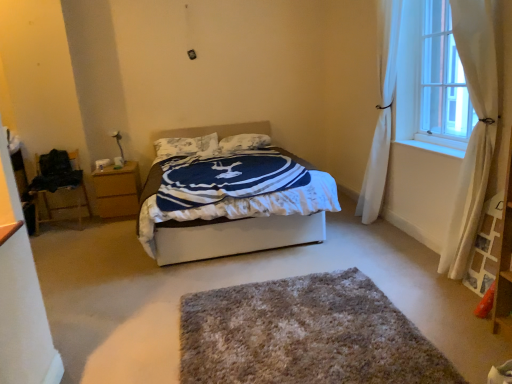
Describe the element at coordinates (232, 236) in the screenshot. I see `white soft bed at center` at that location.

Looking at this image, in order to face white sheer curtain at right, which is the 1th curtain in back-to-front order, should I rotate leftwards or rightwards?

Rotate your view right by about 16.574°.

This screenshot has width=512, height=384. What do you see at coordinates (117, 190) in the screenshot? I see `wooden nightstand at left` at bounding box center [117, 190].

At what (x,y) coordinates should I click in order to perform the action: click on white soft bed at center. Please return your answer as a coordinate pair (x, y). The image size is (512, 384). Looking at the image, I should click on (232, 236).

Which is behind, point (170, 150) or point (392, 67)?

The point (170, 150) is farther from the camera.

Considering the sizes of textured white pillow at center, marked as the 2th pillow in a right-to-left arrangement, and white sheer curtain at right, the second curtain viewed from the front, in the image, is textured white pillow at center, marked as the 2th pillow in a right-to-left arrangement, bigger or smaller than white sheer curtain at right, the second curtain viewed from the front,?

textured white pillow at center, marked as the 2th pillow in a right-to-left arrangement, is smaller than white sheer curtain at right, the second curtain viewed from the front.

Does textured white pillow at center, marked as the 2th pillow in a right-to-left arrangement, lie behind white sheer curtain at right, which is the 1th curtain in back-to-front order?

That is True.

From the image's perspective, which is below, textured white pillow at center, marked as the 2th pillow in a right-to-left arrangement, or white sheer curtain at right, which is the 1th curtain in back-to-front order?

textured white pillow at center, marked as the 2th pillow in a right-to-left arrangement, is shown below in the image.

Is point (447, 91) closer or farther from the camera than point (484, 57)?

Point (447, 91).

Is white sheer curtain at upper right positioned with its back to white sheer curtain at right, the first curtain positioned from the front?

Yes, white sheer curtain at right, the first curtain positioned from the front, is at the back of white sheer curtain at upper right.

From the image's perspective, is white sheer curtain at upper right above or below white sheer curtain at right, the first curtain positioned from the front?

Clearly, from the image's perspective, white sheer curtain at upper right is above white sheer curtain at right, the first curtain positioned from the front.

Considering the sizes of objects white sheer curtain at upper right and white sheer curtain at right, which is the second curtain in back-to-front order, in the image provided, who is shorter, white sheer curtain at upper right or white sheer curtain at right, which is the second curtain in back-to-front order,?

Standing shorter between the two is white sheer curtain at upper right.

Is white soft pillow at center, marked as the 2th pillow in a left-to-right arrangement, turned away from white sheer curtain at right, which is the second curtain in back-to-front order?

white soft pillow at center, marked as the 2th pillow in a left-to-right arrangement, does not have its back to white sheer curtain at right, which is the second curtain in back-to-front order.

Does white soft pillow at center, acting as the 1th pillow starting from the right, have a larger size compared to white sheer curtain at right, which is the second curtain in back-to-front order?

No.

How many degrees apart are the facing directions of white soft pillow at center, acting as the 1th pillow starting from the right, and white sheer curtain at right, the first curtain positioned from the front?

The facing directions of white soft pillow at center, acting as the 1th pillow starting from the right, and white sheer curtain at right, the first curtain positioned from the front, are 86.7 degrees apart.

Considering the positions of objects white soft pillow at center, acting as the 1th pillow starting from the right, and white sheer curtain at right, the first curtain positioned from the front, in the image provided, who is more to the right, white soft pillow at center, acting as the 1th pillow starting from the right, or white sheer curtain at right, the first curtain positioned from the front,?

From the viewer's perspective, white sheer curtain at right, the first curtain positioned from the front, appears more on the right side.

From the picture: Which point is more distant from viewer, [468,246] or [199,140]?

The point [199,140] is farther.

Is white sheer curtain at right, the first curtain positioned from the front, to the left of textured white pillow at center, marked as the 2th pillow in a right-to-left arrangement, from the viewer's perspective?

No.

From the picture: Can you confirm if white sheer curtain at right, which is the second curtain in back-to-front order, is bigger than textured white pillow at center, marked as the 2th pillow in a right-to-left arrangement?

Indeed, white sheer curtain at right, which is the second curtain in back-to-front order, has a larger size compared to textured white pillow at center, marked as the 2th pillow in a right-to-left arrangement.

Consider the image. How much distance is there between white sheer curtain at right, the first curtain positioned from the front, and textured white pillow at center, which is the first pillow in left-to-right order?

white sheer curtain at right, the first curtain positioned from the front, is 2.96 meters from textured white pillow at center, which is the first pillow in left-to-right order.

Choose the correct answer: Is white sheer curtain at right, which is the 1th curtain in back-to-front order, inside white sheer curtain at upper right or outside it?

white sheer curtain at right, which is the 1th curtain in back-to-front order, cannot be found inside white sheer curtain at upper right.

Where is `curtain behind the white sheer curtain at upper right`? The height and width of the screenshot is (384, 512). curtain behind the white sheer curtain at upper right is located at coordinates (381, 113).

Considering the sizes of objects white sheer curtain at right, which is the 1th curtain in back-to-front order, and white sheer curtain at upper right in the image provided, who is thinner, white sheer curtain at right, which is the 1th curtain in back-to-front order, or white sheer curtain at upper right?

With smaller width is white sheer curtain at upper right.

Can you confirm if white sheer curtain at right, the second curtain viewed from the front, is smaller than white sheer curtain at upper right?

No.

Does white sheer curtain at right, which is the 1th curtain in back-to-front order, have a lesser width compared to shaggy gray rug at center?

Yes, white sheer curtain at right, which is the 1th curtain in back-to-front order, is thinner than shaggy gray rug at center.

Could shaggy gray rug at center be considered to be inside white sheer curtain at right, the second curtain viewed from the front?

No, shaggy gray rug at center is not inside white sheer curtain at right, the second curtain viewed from the front.

From the image's perspective, is white sheer curtain at right, the second curtain viewed from the front, below shaggy gray rug at center?

No.

Identify the location of curtain that is the 2nd one above the shaggy gray rug at center (from a real-world perspective). (381, 113).

Is white sheer curtain at upper right facing towards white soft pillow at center, acting as the 1th pillow starting from the right?

No, white sheer curtain at upper right does not turn towards white soft pillow at center, acting as the 1th pillow starting from the right.

You are a GUI agent. You are given a task and a screenshot of the screen. Output one action in this format:
    pyautogui.click(x=<x>, y=<y>)
    Task: Click on the window that appears above the white soft pillow at center, acting as the 1th pillow starting from the right (from a real-world perspective)
    
    Given the screenshot: What is the action you would take?
    pyautogui.click(x=431, y=79)

Considering the sizes of white sheer curtain at upper right and white soft pillow at center, acting as the 1th pillow starting from the right, in the image, is white sheer curtain at upper right wider or thinner than white soft pillow at center, acting as the 1th pillow starting from the right,?

Clearly, white sheer curtain at upper right has less width compared to white soft pillow at center, acting as the 1th pillow starting from the right.

Which curtain is the 1st one when counting from the right side of the textured white pillow at center, marked as the 2th pillow in a right-to-left arrangement? Please provide its 2D coordinates.

[(381, 113)]

Where is `window that appears behind the white sheer curtain at right, the first curtain positioned from the front`? window that appears behind the white sheer curtain at right, the first curtain positioned from the front is located at coordinates (431, 79).

In the scene shown: From the image, which object appears to be farther from white sheer curtain at right, which is the 1th curtain in back-to-front order, white sheer curtain at right, the first curtain positioned from the front, or white sheer curtain at upper right?

white sheer curtain at right, the first curtain positioned from the front, is positioned further to the anchor white sheer curtain at right, which is the 1th curtain in back-to-front order.

From the image, which object appears to be farther from white sheer curtain at upper right, white sheer curtain at right, which is the second curtain in back-to-front order, or white soft pillow at center, marked as the 2th pillow in a left-to-right arrangement?

white soft pillow at center, marked as the 2th pillow in a left-to-right arrangement, lies further to white sheer curtain at upper right than the other object.

Estimate the real-world distances between objects in this image. Which object is closer to shaggy gray rug at center, white sheer curtain at right, the first curtain positioned from the front, or white soft pillow at center, acting as the 1th pillow starting from the right?

white sheer curtain at right, the first curtain positioned from the front.

Estimate the real-world distances between objects in this image. Which object is further from white sheer curtain at right, the second curtain viewed from the front, white sheer curtain at upper right or wooden chair at left?

Based on the image, wooden chair at left appears to be further to white sheer curtain at right, the second curtain viewed from the front.

When comparing their distances from textured white pillow at center, marked as the 2th pillow in a right-to-left arrangement, does white soft bed at center or white sheer curtain at right, which is the 1th curtain in back-to-front order, seem closer?

white soft bed at center lies closer to textured white pillow at center, marked as the 2th pillow in a right-to-left arrangement, than the other object.

Based on their spatial positions, is white soft bed at center or white sheer curtain at right, the second curtain viewed from the front, further from shaggy gray rug at center?

white sheer curtain at right, the second curtain viewed from the front, is further to shaggy gray rug at center.

Which object lies nearer to the anchor point shaggy gray rug at center, white sheer curtain at right, the second curtain viewed from the front, or white soft bed at center?

Among the two, white soft bed at center is located nearer to shaggy gray rug at center.

From the image, which object appears to be farther from shaggy gray rug at center, white soft bed at center or white sheer curtain at upper right?

white sheer curtain at upper right lies further to shaggy gray rug at center than the other object.

Identify the location of window between white sheer curtain at right, the first curtain positioned from the front, and white soft pillow at center, acting as the 1th pillow starting from the right, from front to back. This screenshot has width=512, height=384. (431, 79).

The height and width of the screenshot is (384, 512). Find the location of `bed positioned between shaggy gray rug at center and white soft pillow at center, marked as the 2th pillow in a left-to-right arrangement, from near to far`. bed positioned between shaggy gray rug at center and white soft pillow at center, marked as the 2th pillow in a left-to-right arrangement, from near to far is located at coordinates (232, 236).

Find the location of `bed located between shaggy gray rug at center and wooden nightstand at left in the depth direction`. bed located between shaggy gray rug at center and wooden nightstand at left in the depth direction is located at coordinates (232, 236).

Identify the location of bed positioned between shaggy gray rug at center and textured white pillow at center, marked as the 2th pillow in a right-to-left arrangement, from near to far. (232, 236).